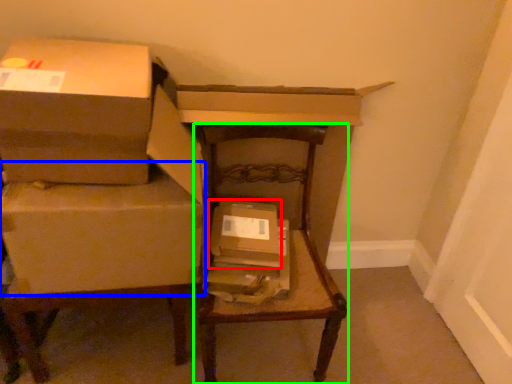
Question: Which is nearer to the box (highlighted by a red box)? box (highlighted by a blue box) or furniture (highlighted by a green box).

Choices:
 (A) box
 (B) furniture

Answer: (B)